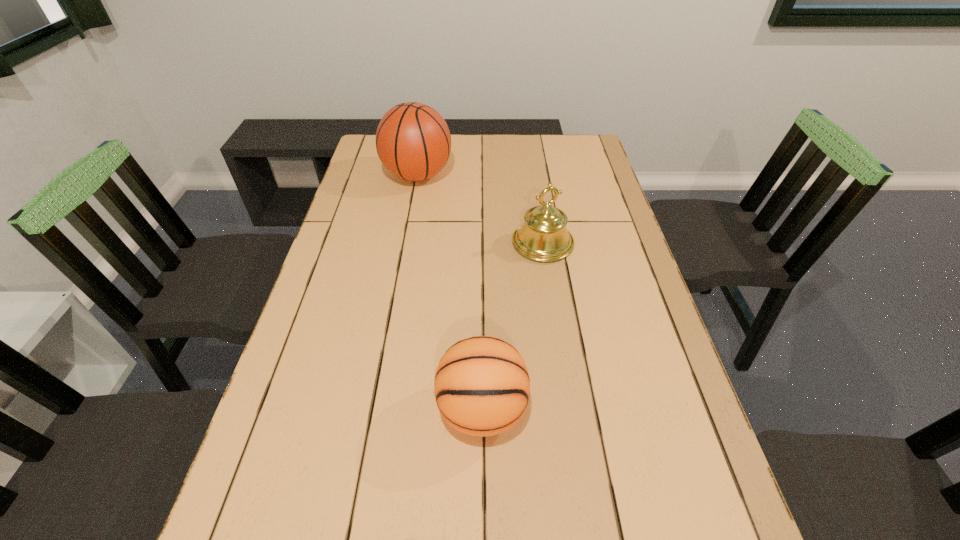
The image size is (960, 540). What are the coordinates of `vacant area that lies between the nearer basketball and the second nearest object` in the screenshot? It's located at (513, 326).

You are a GUI agent. You are given a task and a screenshot of the screen. Output one action in this format:
    pyautogui.click(x=<x>, y=<y>)
    Task: Click on the free space between the second farthest object and the shorter basketball
    The image size is (960, 540).
    Given the screenshot: What is the action you would take?
    [x=513, y=326]

Identify which object is the closest to the shorter basketball. Please provide its 2D coordinates. Your answer should be formatted as a tuple, i.e. [(x, y)], where the tuple contains the x and y coordinates of a point satisfying the conditions above.

[(543, 237)]

This screenshot has width=960, height=540. I want to click on object that is the second nearest to the farther basketball, so click(x=482, y=386).

Locate an element on the screen. The image size is (960, 540). free space that satisfies the following two spatial constraints: 1. on the front side of the bell; 2. on the left side of the left basketball is located at coordinates tap(405, 243).